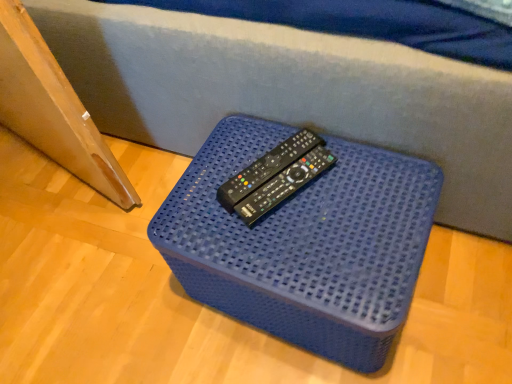
Where is `black plastic remote at center`? The width and height of the screenshot is (512, 384). black plastic remote at center is located at coordinates (266, 168).

What do you see at coordinates (266, 168) in the screenshot?
I see `black plastic remote at center` at bounding box center [266, 168].

This screenshot has width=512, height=384. Describe the element at coordinates (305, 243) in the screenshot. I see `blue plastic container at center` at that location.

The height and width of the screenshot is (384, 512). In order to click on blue plastic container at center in this screenshot , I will do `click(305, 243)`.

What are the coordinates of `black plastic remote at center` in the screenshot? It's located at (266, 168).

Between black plastic remote at center and blue plastic container at center, which one appears on the left side from the viewer's perspective?

black plastic remote at center is more to the left.

Is black plastic remote at center further to the viewer compared to blue plastic container at center?

Yes, it is.

Which is further, (254, 176) or (197, 233)?

The point (254, 176) is behind.

In the scene shown: From the image's perspective, between black plastic remote at center and blue plastic container at center, which one is located above?

black plastic remote at center, from the image's perspective.

From a real-world perspective, is black plastic remote at center under blue plastic container at center?

No.

Between black plastic remote at center and blue plastic container at center, which one has larger width?

blue plastic container at center.

Considering the relative sizes of black plastic remote at center and blue plastic container at center in the image provided, is black plastic remote at center shorter than blue plastic container at center?

Yes, black plastic remote at center is shorter than blue plastic container at center.

Does black plastic remote at center have a smaller size compared to blue plastic container at center?

Correct, black plastic remote at center occupies less space than blue plastic container at center.

Is blue plastic container at center surrounded by black plastic remote at center?

Definitely not — blue plastic container at center is not inside black plastic remote at center.

Consider the image. Are black plastic remote at center and blue plastic container at center far apart?

black plastic remote at center is actually quite close to blue plastic container at center.

Is black plastic remote at center facing away from blue plastic container at center?

black plastic remote at center is not turned away from blue plastic container at center.

Can you tell me how much black plastic remote at center and blue plastic container at center differ in facing direction?

The angular difference between black plastic remote at center and blue plastic container at center is 28.1 degrees.

Find the location of a particular element. The width and height of the screenshot is (512, 384). furniture that is in front of the black plastic remote at center is located at coordinates (305, 243).

Is blue plastic container at center to the left of black plastic remote at center from the viewer's perspective?

In fact, blue plastic container at center is to the right of black plastic remote at center.

Is blue plastic container at center positioned before black plastic remote at center?

Yes, blue plastic container at center is closer to the viewer.

Considering the positions of point (294, 279) and point (284, 151), is point (294, 279) closer or farther from the camera than point (284, 151)?

Point (294, 279) is positioned closer to the camera compared to point (284, 151).

From the image's perspective, which one is positioned higher, blue plastic container at center or black plastic remote at center?

From the image's view, black plastic remote at center is above.

From a real-world perspective, which is physically below, blue plastic container at center or black plastic remote at center?

In real-world perspective, blue plastic container at center is lower.

Is blue plastic container at center wider than black plastic remote at center?

Yes.

Does blue plastic container at center have a greater height compared to black plastic remote at center?

Correct, blue plastic container at center is much taller as black plastic remote at center.

Between blue plastic container at center and black plastic remote at center, which one has larger size?

Bigger between the two is blue plastic container at center.

Is blue plastic container at center not inside black plastic remote at center?

Yes, blue plastic container at center is not within black plastic remote at center.

Is there a large distance between blue plastic container at center and black plastic remote at center?

No.

Could you tell me if blue plastic container at center is turned towards black plastic remote at center?

No, blue plastic container at center is not oriented towards black plastic remote at center.

Can you tell me how much blue plastic container at center and black plastic remote at center differ in facing direction?

They differ by 28.1 degrees in their facing directions.

You are a GUI agent. You are given a task and a screenshot of the screen. Output one action in this format:
    pyautogui.click(x=<x>, y=<y>)
    Task: Click on the remote above the blue plastic container at center (from a real-world perspective)
    
    Given the screenshot: What is the action you would take?
    pyautogui.click(x=266, y=168)

Where is `furniture below the black plastic remote at center (from a real-world perspective)`? furniture below the black plastic remote at center (from a real-world perspective) is located at coordinates (305, 243).

Where is `remote above the blue plastic container at center (from the image's perspective)`? The image size is (512, 384). remote above the blue plastic container at center (from the image's perspective) is located at coordinates (266, 168).